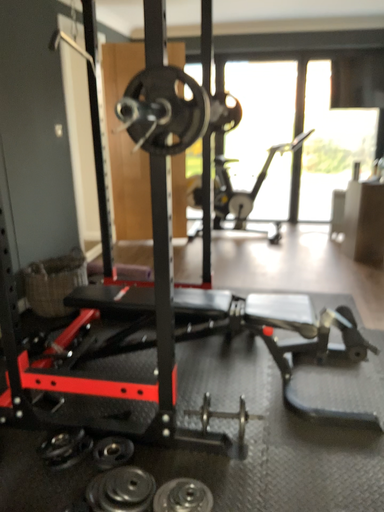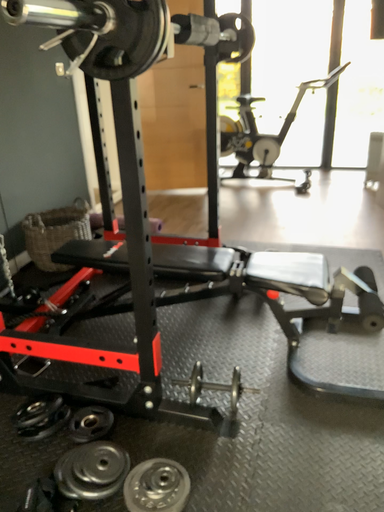
Question: Which way did the camera rotate in the video?

Choices:
 (A) rotated downward
 (B) rotated upward

Answer: (A)